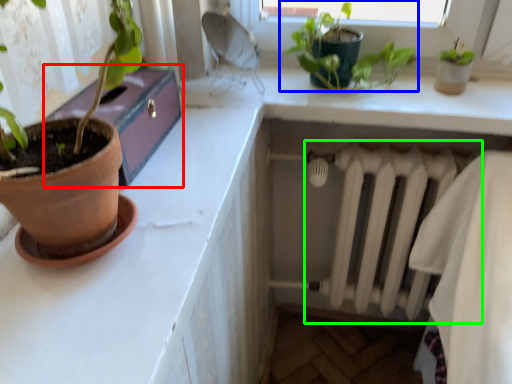
Question: Which object is the farthest from window box (highlighted by a red box)? Choose among these: houseplant (highlighted by a blue box) or radiator (highlighted by a green box).

Choices:
 (A) houseplant
 (B) radiator

Answer: (B)